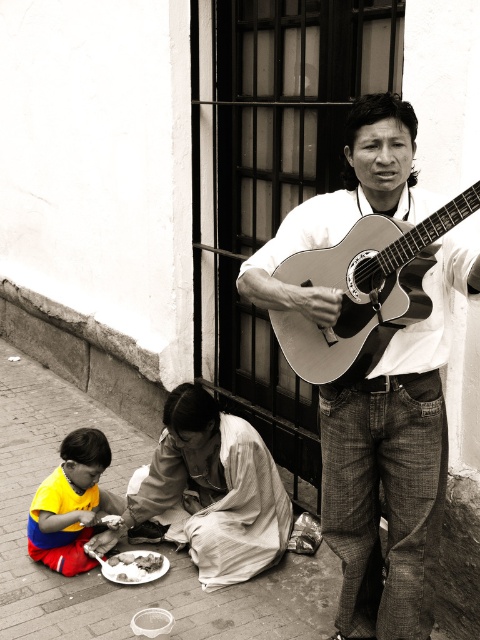
You are standing at the center of the image. Which direction should you move to reach the point labeled as point (40, 477)?

The point (40, 477) is located at the lower left, so you should move towards the lower left direction to reach it.

You are a photographer standing in front of the scene. You want to take a photo of the yellow fabric shirt at lower left and the brick pavement at lower left. Which object is positioned closer to your camera lens?

The brick pavement at lower left is closer to the viewer than the yellow fabric shirt at lower left, so the brick pavement at lower left will be closer to your camera lens.

You are a street performer who needs to place your wooden acoustic guitar at center near the white crumbly bread at lower left. Can you safely place it within 1.5 meters without moving the bread?

The wooden acoustic guitar at center is 1.60 meters away from the white crumbly bread at lower left. Since 1.60 meters is greater than 1.5 meters, you cannot place it within the desired distance without moving the bread.